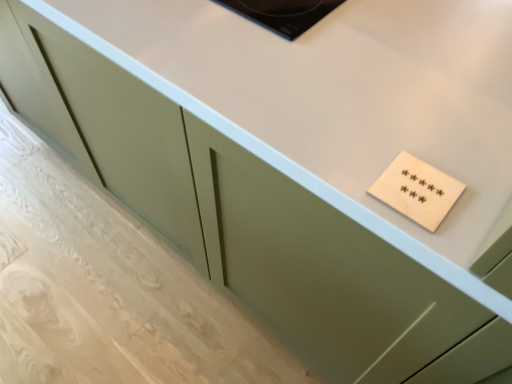
Locate an element on the screen. free space to the left of wooden plaque at upper right is located at coordinates (335, 169).